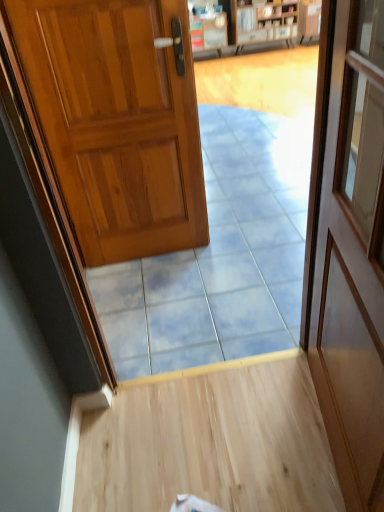
Question: Is wooden door at right, the 1th door positioned from the front, to the left or to the right of shiny wood door at left, positioned as the second door in right-to-left order, in the image?

Choices:
 (A) right
 (B) left

Answer: (A)

Question: Considering the positions of point (375, 510) and point (109, 238), is point (375, 510) closer or farther from the camera than point (109, 238)?

Choices:
 (A) closer
 (B) farther

Answer: (A)

Question: Considering the real-world distances, which object is farthest from the wooden bookshelf at upper center?

Choices:
 (A) wooden door at right, marked as the 2th door in a back-to-front arrangement
 (B) blue glossy tile at center
 (C) shiny wood door at left, positioned as the 1th door in back-to-front order

Answer: (A)

Question: Which of these objects is positioned farthest from the blue glossy tile at center?

Choices:
 (A) wooden door at right, the 1th door positioned from the front
 (B) shiny wood door at left, the first door viewed from the left
 (C) wooden bookshelf at upper center

Answer: (C)